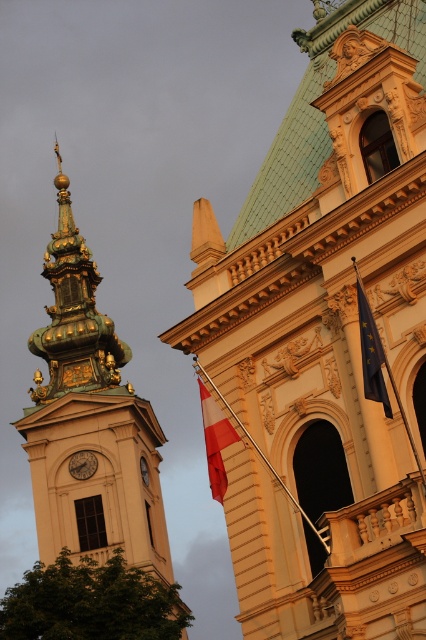
Is wooden clock at left bigger than golden metallic clock at left?

Indeed, wooden clock at left has a larger size compared to golden metallic clock at left.

Is wooden clock at left above golden metallic clock at left?

Indeed, wooden clock at left is positioned over golden metallic clock at left.

Identify the location of wooden clock at left. (83, 465).

Does gold/gilded metal clock tower at left have a lesser height compared to golden metallic clock at left?

No.

Is point (117, 508) closer to viewer compared to point (146, 481)?

Yes, point (117, 508) is closer to viewer.

Find the location of a particular element. This screenshot has height=640, width=426. gold/gilded metal clock tower at left is located at coordinates (89, 420).

Who is lower down, blue fabric flag at center-right or wooden clock at left?

wooden clock at left

Identify the location of blue fabric flag at center-right. This screenshot has height=640, width=426. (373, 353).